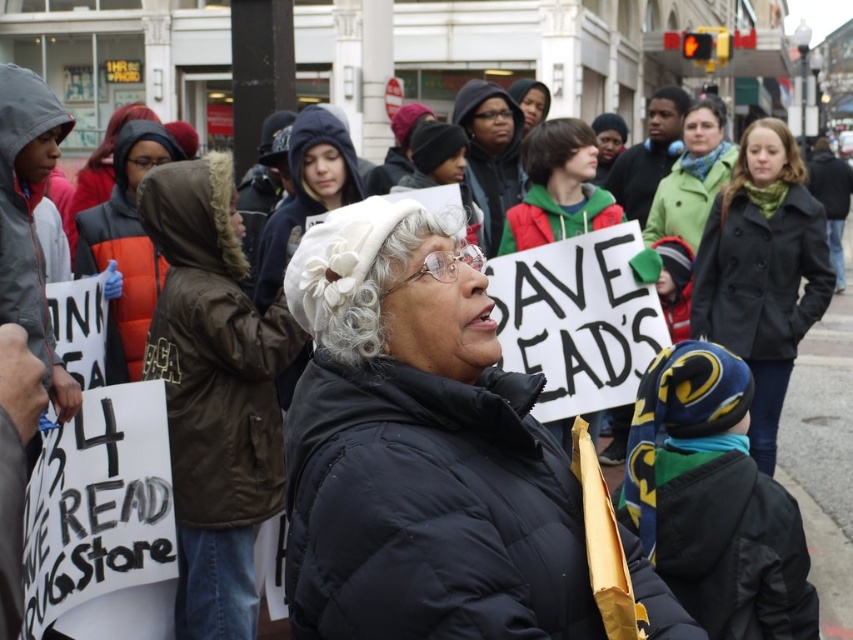
Question: Which point appears farthest from the camera in this image?

Choices:
 (A) (378, 308)
 (B) (456, 99)
 (C) (701, 96)
 (D) (782, 154)

Answer: (C)

Question: Which point is closer to the camera?

Choices:
 (A) white fabric hat at center
 (B) matte brown coat at center
 (C) white fabric wig at upper center
 (D) black puffy coat at center

Answer: (D)

Question: Which object is positioned closest to the white fluffy wig at center?

Choices:
 (A) blonde synthetic wig at upper right
 (B) dark gray wool coat at center
 (C) white fabric wig at upper center
 (D) orange puffer jacket at left

Answer: (B)

Question: Can you confirm if white fabric hat at center is thinner than fuzzy brown wig at upper left?

Choices:
 (A) yes
 (B) no

Answer: (A)

Question: Does black puffy coat at center have a larger size compared to blonde synthetic wig at upper right?

Choices:
 (A) no
 (B) yes

Answer: (A)

Question: Does matte brown coat at center appear on the left side of white fabric wig at upper center?

Choices:
 (A) yes
 (B) no

Answer: (A)